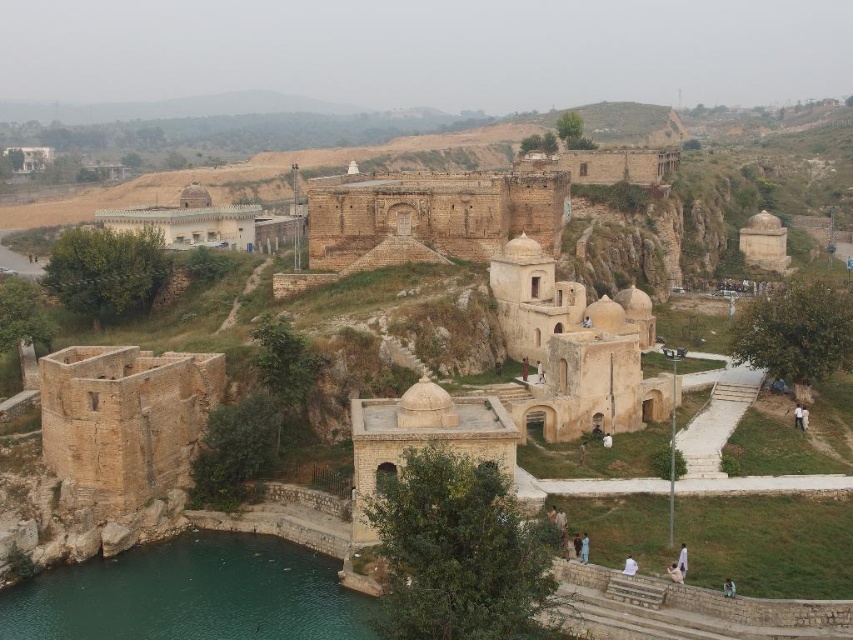
Question: Is light brown stone palace at upper left to the left of white cloth at lower center from the viewer's perspective?

Choices:
 (A) no
 (B) yes

Answer: (B)

Question: Does green stone water at lower left have a smaller size compared to brown stone palace at center?

Choices:
 (A) yes
 (B) no

Answer: (A)

Question: Which object appears closest to the camera in this image?

Choices:
 (A) green stone water at lower left
 (B) brown stone palace at center
 (C) light brown stone palace at upper left
 (D) white cloth at lower center

Answer: (A)

Question: Which object is the closest to the light brown stone palace at upper left?

Choices:
 (A) white cloth at lower center
 (B) green stone water at lower left
 (C) brown stone palace at center

Answer: (C)

Question: In this image, where is brown stone palace at center located relative to white cloth at lower center?

Choices:
 (A) right
 (B) left

Answer: (B)

Question: Which point is farther from the camera taking this photo?

Choices:
 (A) (1, 632)
 (B) (373, 180)

Answer: (B)